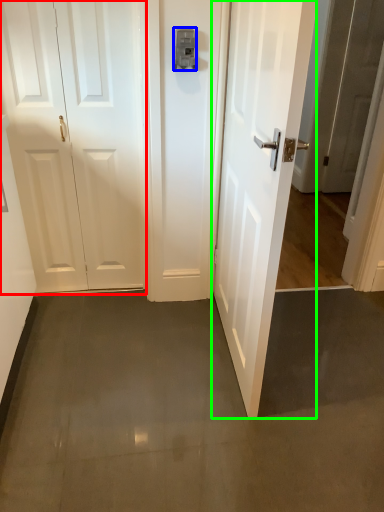
Question: Estimate the real-world distances between objects in this image. Which object is closer to door (highlighted by a red box), latch (highlighted by a blue box) or door (highlighted by a green box)?

Choices:
 (A) latch
 (B) door

Answer: (A)